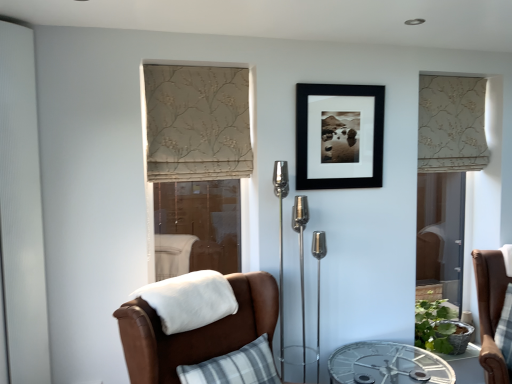
Where is `clear glass table at center`? clear glass table at center is located at coordinates (387, 364).

Locate an element on the screen. The image size is (512, 384). white fluffy blanket at lower left is located at coordinates (189, 300).

What is the approximate height of beige floral fabric curtain at right, the 2th curtain when ordered from front to back?

24.18 inches.

Measure the distance between point (223, 98) and camera.

Point (223, 98) and camera are 7.50 feet apart.

How much space does white textured screen door at left, the 1th screen door when ordered from left to right, occupy horizontally?

The width of white textured screen door at left, the 1th screen door when ordered from left to right, is 3.64 inches.

You are a GUI agent. You are given a task and a screenshot of the screen. Output one action in this format:
    pyautogui.click(x=<x>, y=<y>)
    Task: Click on the clear glass table at center
    
    Given the screenshot: What is the action you would take?
    pyautogui.click(x=387, y=364)

Is white textured screen door at left, arranged as the 3th screen door when viewed from the right, wider than brown leather chair at right?

No.

Based on the photo, who is smaller, white textured screen door at left, arranged as the 3th screen door when viewed from the right, or brown leather chair at right?

Smaller between the two is white textured screen door at left, arranged as the 3th screen door when viewed from the right.

Is white textured screen door at left, placed as the 1th screen door when sorted from front to back, taller than brown leather chair at right?

Yes, white textured screen door at left, placed as the 1th screen door when sorted from front to back, is taller than brown leather chair at right.

Is white fluffy blanket at lower left facing away from clear glass screen door at right, the 3th screen door viewed from the left?

white fluffy blanket at lower left is not turned away from clear glass screen door at right, the 3th screen door viewed from the left.

Who is smaller, white fluffy blanket at lower left or clear glass screen door at right, the 3th screen door viewed from the left?

With smaller size is clear glass screen door at right, the 3th screen door viewed from the left.

Between white fluffy blanket at lower left and clear glass screen door at right, the 3th screen door viewed from the left, which one has more height?

With more height is clear glass screen door at right, the 3th screen door viewed from the left.

Does transparent glass screen door at center, which is the 2th screen door from front to back, turn towards clear glass screen door at right, the 3th screen door viewed from the left?

No, transparent glass screen door at center, which is the 2th screen door from front to back, does not turn towards clear glass screen door at right, the 3th screen door viewed from the left.

From a real-world perspective, is transparent glass screen door at center, which is the 2th screen door from front to back, over clear glass screen door at right, arranged as the 1th screen door when viewed from the back?

Yes, from a real-world perspective, transparent glass screen door at center, which is the 2th screen door from front to back, is above clear glass screen door at right, arranged as the 1th screen door when viewed from the back.

Which is nearer, [170,193] or [448,236]?

The point [448,236] is in front.

Which is behind, transparent glass screen door at center, which is the 2th screen door from front to back, or clear glass screen door at right, the first screen door positioned from the right?

clear glass screen door at right, the first screen door positioned from the right, is further away from the camera.

Is beige floral fabric curtain at center, the second curtain positioned from the right, spatially inside beige floral fabric curtain at right, arranged as the first curtain when viewed from the back, or outside of it?

beige floral fabric curtain at center, the second curtain positioned from the right, is located beyond the bounds of beige floral fabric curtain at right, arranged as the first curtain when viewed from the back.

Is beige floral fabric curtain at center, which ranks as the first curtain in left-to-right order, thinner than beige floral fabric curtain at right, positioned as the 1th curtain in right-to-left order?

Yes, beige floral fabric curtain at center, which ranks as the first curtain in left-to-right order, is thinner than beige floral fabric curtain at right, positioned as the 1th curtain in right-to-left order.

Considering the positions of points (244, 163) and (428, 135), is point (244, 163) closer to camera compared to point (428, 135)?

Yes, it is in front of point (428, 135).

Does beige floral fabric curtain at center, marked as the second curtain in a back-to-front arrangement, turn towards beige floral fabric curtain at right, positioned as the 1th curtain in right-to-left order?

No, beige floral fabric curtain at center, marked as the second curtain in a back-to-front arrangement, is not aimed at beige floral fabric curtain at right, positioned as the 1th curtain in right-to-left order.

Could you tell me if brown leather chair at right is turned towards black matte picture frame at center?

No, brown leather chair at right is not turned towards black matte picture frame at center.

Between brown leather chair at right and black matte picture frame at center, which one is positioned behind?

black matte picture frame at center is behind.

Does brown leather chair at right have a lesser width compared to black matte picture frame at center?

No, brown leather chair at right is not thinner than black matte picture frame at center.

Is brown leather chair at right with black matte picture frame at center?

No.

Is clear glass table at center not within brown leather chair at right?

Indeed, clear glass table at center is completely outside brown leather chair at right.

Considering the positions of objects clear glass table at center and brown leather chair at right in the image provided, who is more to the left, clear glass table at center or brown leather chair at right?

From the viewer's perspective, clear glass table at center appears more on the left side.

Which point is more distant from viewer, (406,345) or (496,366)?

Positioned behind is point (406,345).

In the scene shown: Is clear glass table at center turned away from brown leather chair at right?

No, brown leather chair at right is not at the back of clear glass table at center.

Could you measure the distance between clear glass screen door at right, the first screen door positioned from the right, and white fluffy blanket at lower left?

clear glass screen door at right, the first screen door positioned from the right, is 1.90 meters away from white fluffy blanket at lower left.

Considering the points (430, 219) and (233, 292), which point is behind, point (430, 219) or point (233, 292)?

The point (430, 219) is more distant.

Between clear glass screen door at right, the 3th screen door viewed from the left, and white fluffy blanket at lower left, which one has smaller size?

clear glass screen door at right, the 3th screen door viewed from the left, is smaller.

Between clear glass screen door at right, which is the 3th screen door in front-to-back order, and white fluffy blanket at lower left, which one is positioned behind?

clear glass screen door at right, which is the 3th screen door in front-to-back order, is further from the camera.

Identify the location of chair beneath the white textured screen door at left, the 1th screen door when ordered from left to right (from a real-world perspective). This screenshot has width=512, height=384. (490, 310).

This screenshot has width=512, height=384. In order to click on screen door that is the 3rd object located behind the white fluffy blanket at lower left in this screenshot , I will do `click(441, 232)`.

Based on the photo, which object lies nearer to the anchor point clear glass table at center, clear glass screen door at right, the first screen door positioned from the right, or transparent glass screen door at center, marked as the second screen door in a back-to-front arrangement?

Based on the image, clear glass screen door at right, the first screen door positioned from the right, appears to be nearer to clear glass table at center.

Looking at the image, which one is located further to brown leather chair at right, white fluffy blanket at lower left or black matte picture frame at center?

white fluffy blanket at lower left.

In the scene shown: From the image, which object appears to be nearer to clear glass table at center, clear glass screen door at right, which is the 3th screen door in front-to-back order, or brown leather chair at right?

brown leather chair at right.

Considering their positions, is white textured screen door at left, placed as the 1th screen door when sorted from front to back, positioned further to black matte picture frame at center than white fluffy blanket at lower left?

white textured screen door at left, placed as the 1th screen door when sorted from front to back.

When comparing their distances from clear glass table at center, does brown leather chair at right or black matte picture frame at center seem closer?

brown leather chair at right is closer to clear glass table at center.

In the scene shown: Looking at the image, which one is located closer to black matte picture frame at center, white textured screen door at left, which is the third screen door in back-to-front order, or beige floral fabric curtain at center, the first curtain in the front-to-back sequence?

Among the two, beige floral fabric curtain at center, the first curtain in the front-to-back sequence, is located nearer to black matte picture frame at center.

Looking at this image, from the image, which object appears to be nearer to clear glass table at center, beige floral fabric curtain at right, arranged as the first curtain when viewed from the back, or transparent glass screen door at center, placed as the 2th screen door when sorted from right to left?

Based on the image, beige floral fabric curtain at right, arranged as the first curtain when viewed from the back, appears to be nearer to clear glass table at center.

Estimate the real-world distances between objects in this image. Which object is closer to transparent glass screen door at center, which is the 2th screen door from front to back, black matte picture frame at center or white textured screen door at left, arranged as the 3th screen door when viewed from the right?

Based on the image, black matte picture frame at center appears to be nearer to transparent glass screen door at center, which is the 2th screen door from front to back.

Locate an element on the screen. picture frame located between white fluffy blanket at lower left and clear glass screen door at right, the first screen door positioned from the right, in the left-right direction is located at coordinates (339, 136).

The image size is (512, 384). Identify the location of picture frame between white fluffy blanket at lower left and brown leather chair at right from left to right. (339, 136).

The height and width of the screenshot is (384, 512). Identify the location of picture frame between transparent glass screen door at center, marked as the second screen door in a back-to-front arrangement, and clear glass screen door at right, arranged as the 1th screen door when viewed from the back. (339, 136).

I want to click on blanket between white textured screen door at left, the 1th screen door when ordered from left to right, and beige floral fabric curtain at right, the 2th curtain when ordered from front to back, from left to right, so click(189, 300).